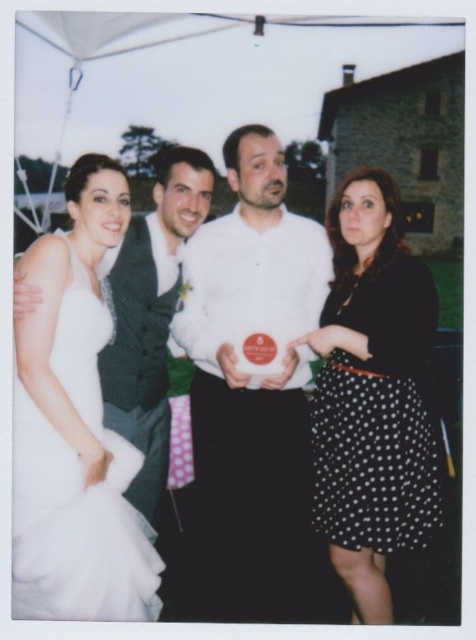
Question: Is the position of white matte shirt at center less distant than that of black dotted skirt at right?

Choices:
 (A) yes
 (B) no

Answer: (B)

Question: Can you confirm if white matte shirt at center is positioned below black dotted skirt at right?

Choices:
 (A) yes
 (B) no

Answer: (B)

Question: Considering the real-world distances, which object is closest to the white matte shirt at center?

Choices:
 (A) white tulle dress at left
 (B) white satin dress at left
 (C) black dotted skirt at right

Answer: (B)

Question: Which is nearer to the white tulle dress at left?

Choices:
 (A) black dotted skirt at right
 (B) white matte shirt at center

Answer: (B)

Question: Is black dotted skirt at right bigger than white tulle dress at left?

Choices:
 (A) no
 (B) yes

Answer: (B)

Question: Which object is positioned closest to the black dotted skirt at right?

Choices:
 (A) white satin dress at left
 (B) white matte shirt at center
 (C) white tulle dress at left

Answer: (A)